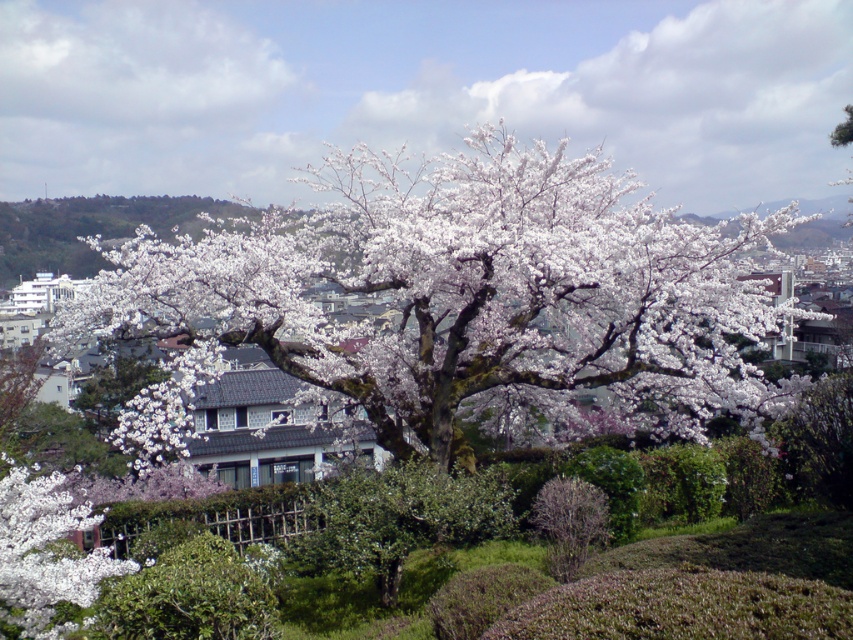
You are a gardener planning to water the green leafy bush at center and the bare branches at center. Since you can only water one at a time, which one should you water first to ensure both get enough water before the sun gets too high? Use the spatial information provided to decide.

You should water the green leafy bush at center first because the bare branches at center is behind it. Watering the front plant first allows the water to reach the back plant more effectively if any moisture evaporates or trickles down.

You are planning to install a small garden path between the white matte tree at center and the green leafy bush at center. The path will be 35 feet long. Will the path be long enough to connect both ends?

The white matte tree at center and green leafy bush at center are 36.20 feet apart from each other. The path is only 35 feet long, so it will not be long enough to connect both ends.

You are planning to plant a new flower bed between the white matte tree at center and the green leafy bush at center. Considering their sizes, which one would require more space to accommodate its root system?

The white matte tree at center is larger in size than the green leafy bush at center, so it would require more space to accommodate its root system.